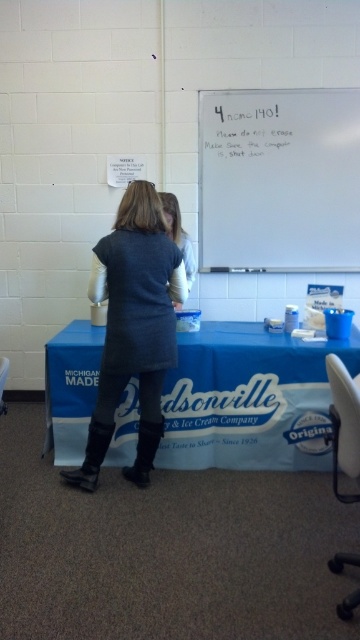
Question: Is whiteboard at upper center smaller than dark gray sweater at center?

Choices:
 (A) yes
 (B) no

Answer: (A)

Question: Which point is farther from the camera taking this photo?

Choices:
 (A) (187, 260)
 (B) (78, 476)

Answer: (A)

Question: Which point is farther to the camera?

Choices:
 (A) (293, 218)
 (B) (105, 452)

Answer: (A)

Question: Does blue fabric table at center come in front of black leather boot at lower center?

Choices:
 (A) no
 (B) yes

Answer: (A)

Question: Estimate the real-world distances between objects in this image. Which object is closer to the black leather boot at lower left?

Choices:
 (A) white matte marker at upper center
 (B) light gray sweater at center
 (C) black leather boot at lower center
 (D) blue fabric table at center

Answer: (C)

Question: Is blue fabric table at center above black leather boot at lower left?

Choices:
 (A) yes
 (B) no

Answer: (A)